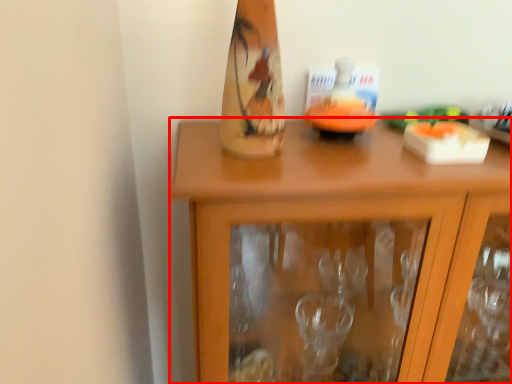
Question: From the image's perspective, what is the correct spatial relationship of cabinetry (annotated by the red box) in relation to candle holder?

Choices:
 (A) below
 (B) above

Answer: (A)